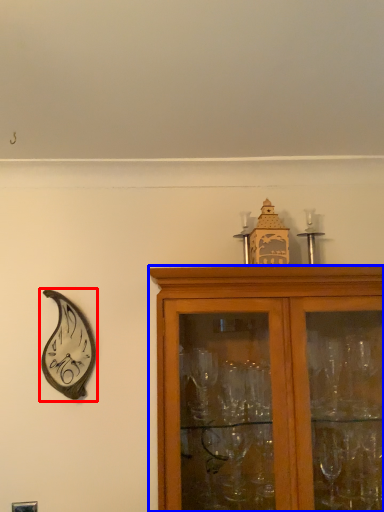
Question: Which object appears closest to the camera in this image, clock (highlighted by a red box) or cabinetry (highlighted by a blue box)?

Choices:
 (A) clock
 (B) cabinetry

Answer: (B)